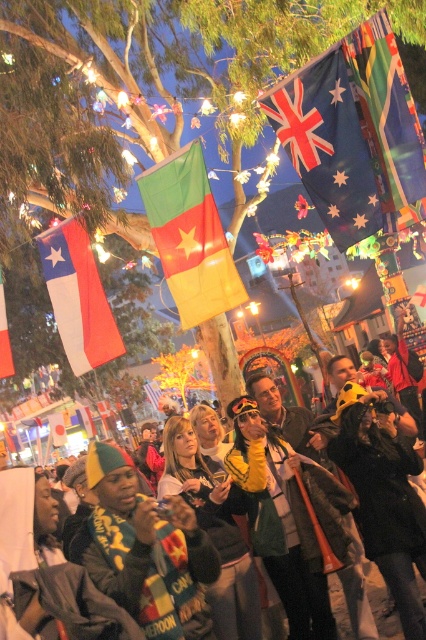
Question: Is blue fabric flag at upper center bigger than white fabric flag at left?

Choices:
 (A) yes
 (B) no

Answer: (B)

Question: Is green fabric flag at center bigger than multicolored fabric flag at upper center?

Choices:
 (A) yes
 (B) no

Answer: (A)

Question: Which point appears closest to the camera in this image?

Choices:
 (A) (317, 150)
 (B) (187, 609)
 (C) (55, 488)

Answer: (B)

Question: Can you confirm if yellow-green fabric scarf at center is positioned below yellow-green jersey at center?

Choices:
 (A) yes
 (B) no

Answer: (B)

Question: Which object is positioned farthest from the yellow-green fabric scarf at center?

Choices:
 (A) white fabric flag at center
 (B) green fabric flag at center
 (C) yellow-green jersey at center
 (D) multicolored fabric flag at upper center

Answer: (D)

Question: Which is farther from the multicolored fabric flag at upper center?

Choices:
 (A) blue fabric flag at upper center
 (B) yellow-green fabric scarf at center

Answer: (B)